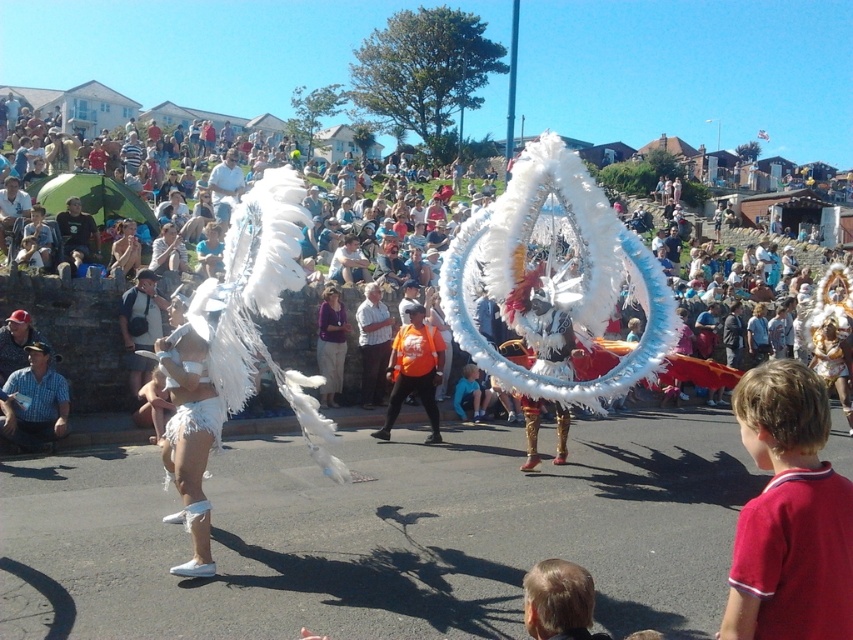
You are standing in the crowd watching the performers. There are two points marked in the scene. The first point is at coordinate point (840,532) and the second is at point (483,400). Which point is closer to you?

Point (840,532) is closer to the viewer than point (483,400).

You are a photographer at the festival and want to capture both performers in a single frame. The two performers are located at point (x=431, y=442) and point (x=461, y=385). Which performer is closer to the camera so that you can focus on them first?

Point (x=431, y=442) is in front of point (x=461, y=385), so the performer at point (x=431, y=442) is closer to the camera and should be focused on first.